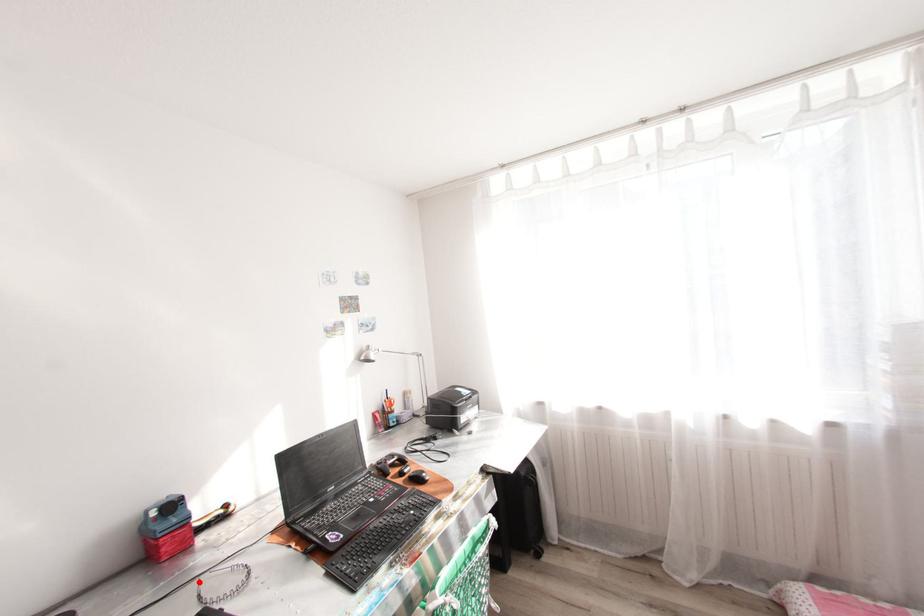
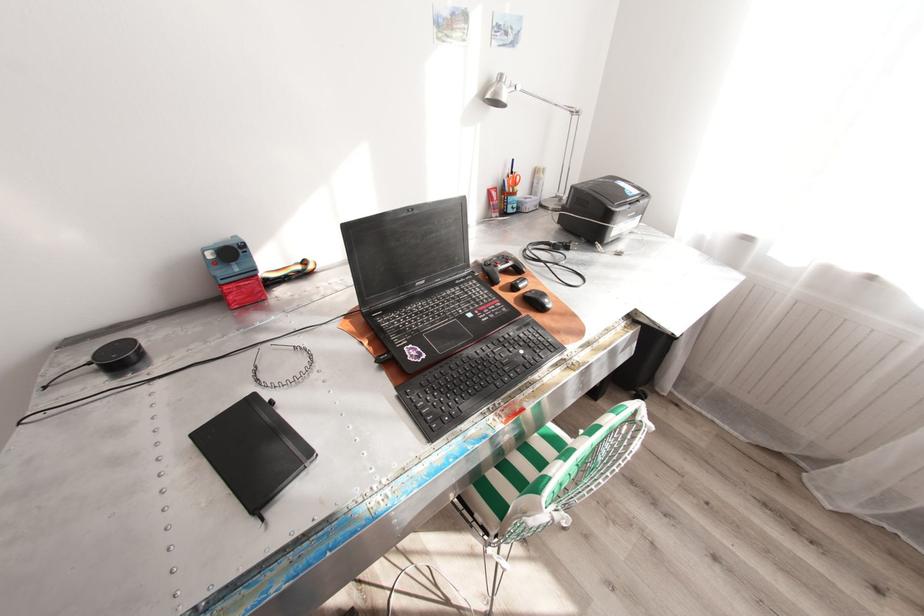
Find the pixel in the second image that matches the highlighted location in the first image.

(259, 351)